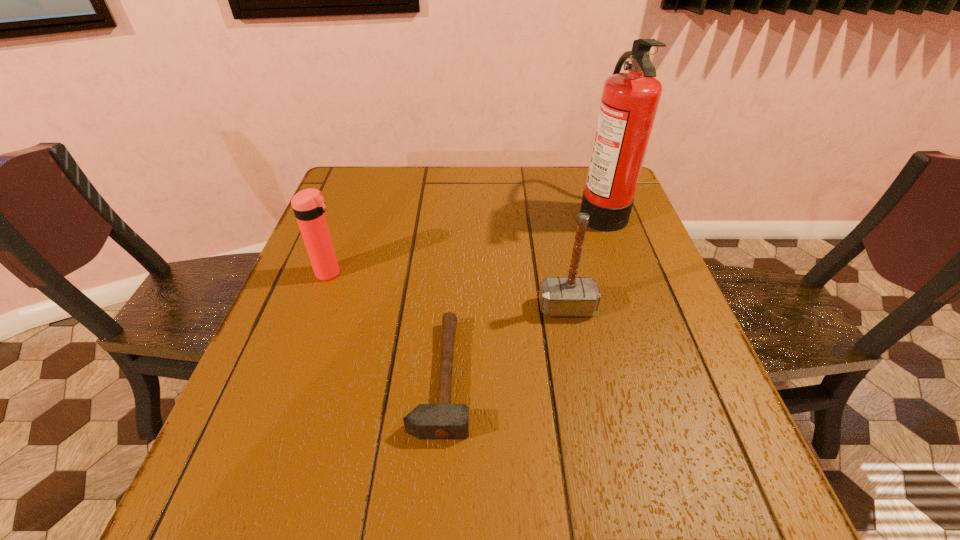
You are a GUI agent. You are given a task and a screenshot of the screen. Output one action in this format:
    pyautogui.click(x=<x>, y=<y>)
    Task: Click on the vacant area that lies between the shorter hammer and the leftmost object
    
    Given the screenshot: What is the action you would take?
    pyautogui.click(x=386, y=325)

Where is `free space between the shortest object and the second farthest object`? The image size is (960, 540). free space between the shortest object and the second farthest object is located at coordinates (386, 325).

What are the coordinates of `free space that is in between the leftmost object and the shorter hammer` in the screenshot? It's located at (386, 325).

Locate which object is the second closest to the farthest object. Please provide its 2D coordinates. Your answer should be formatted as a tuple, i.e. [(x, y)], where the tuple contains the x and y coordinates of a point satisfying the conditions above.

[(443, 420)]

Select which object is the third closest to the tallest object. Please provide its 2D coordinates. Your answer should be formatted as a tuple, i.e. [(x, y)], where the tuple contains the x and y coordinates of a point satisfying the conditions above.

[(308, 205)]

Image resolution: width=960 pixels, height=540 pixels. In order to click on free space that satisfies the following two spatial constraints: 1. on the striking surface of the third farthest object; 2. on the striking surface of the nearer hammer in this screenshot , I will do `click(580, 376)`.